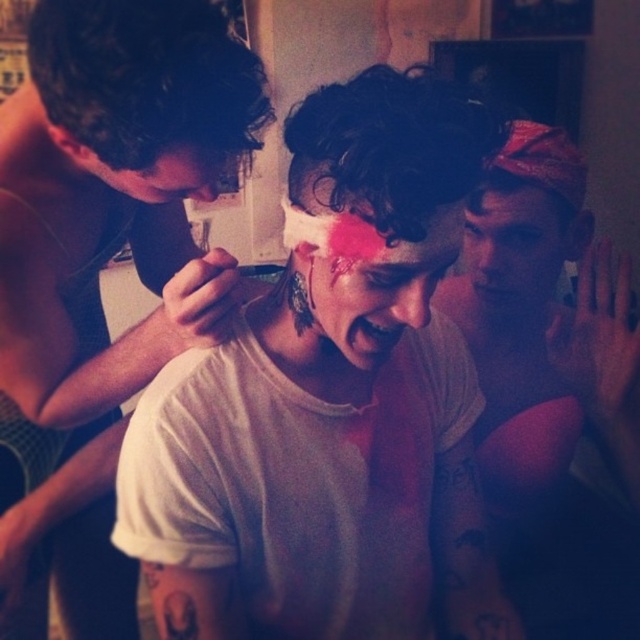
Question: Does white matte shirt at left have a lesser width compared to white matte bandana at upper right?

Choices:
 (A) yes
 (B) no

Answer: (B)

Question: Considering the real-world distances, which object is closest to the matte pink paint at center?

Choices:
 (A) white matte t-shirt at center
 (B) white matte bandana at upper right
 (C) matte black face at upper left

Answer: (A)

Question: Where is white matte bandana at upper right located in relation to matte black face at upper left in the image?

Choices:
 (A) left
 (B) right

Answer: (B)

Question: Is white matte t-shirt at center below white matte shirt at left?

Choices:
 (A) yes
 (B) no

Answer: (A)

Question: Which point is closer to the camera?

Choices:
 (A) white matte t-shirt at center
 (B) white matte bandana at upper right
 (C) smooth skin face at upper right
 (D) white matte shirt at left

Answer: (A)

Question: Among these points, which one is farthest from the camera?

Choices:
 (A) (484, 234)
 (B) (317, 326)

Answer: (A)